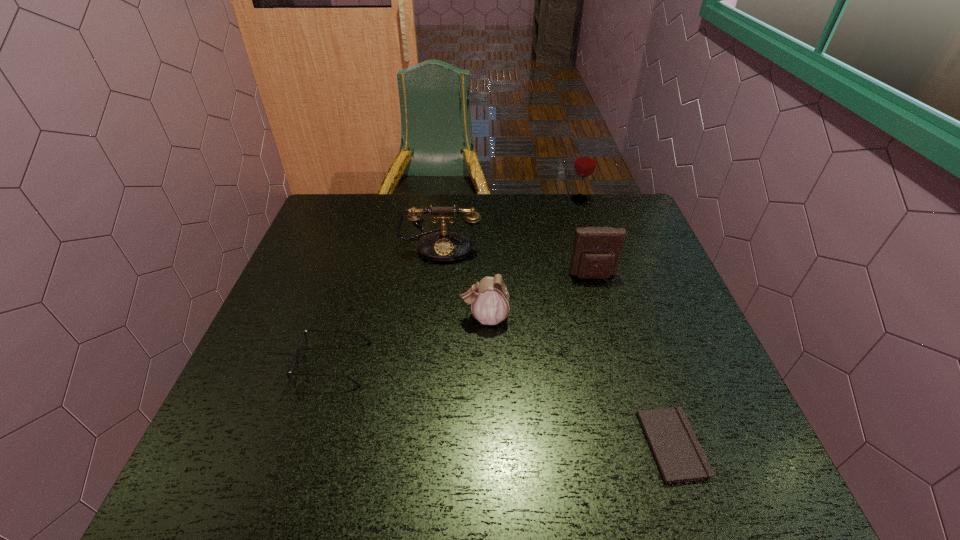
The height and width of the screenshot is (540, 960). What are the coordinates of `telephone at the far edge` in the screenshot? It's located at (444, 246).

At what (x,y) coordinates should I click in order to perform the action: click on object at the near edge. Please return your answer as a coordinate pair (x, y). Image resolution: width=960 pixels, height=540 pixels. Looking at the image, I should click on (680, 458).

Image resolution: width=960 pixels, height=540 pixels. What are the coordinates of `object that is at the left edge` in the screenshot? It's located at (304, 332).

Where is `glass positioned at the right edge`? This screenshot has width=960, height=540. glass positioned at the right edge is located at coordinates (585, 162).

The width and height of the screenshot is (960, 540). In order to click on pouch that is at the right edge in this screenshot , I will do click(597, 250).

Where is `checkbook located in the right edge section of the desktop`? This screenshot has height=540, width=960. checkbook located in the right edge section of the desktop is located at coordinates (680, 458).

This screenshot has width=960, height=540. I want to click on object that is at the far right corner, so click(585, 162).

Where is `object located at the near right corner`? The height and width of the screenshot is (540, 960). object located at the near right corner is located at coordinates (680, 458).

I want to click on vacant area at the far edge of the desktop, so pyautogui.click(x=426, y=207).

At what (x,y) coordinates should I click in order to perform the action: click on vacant point at the left edge. Please return your answer as a coordinate pair (x, y). The height and width of the screenshot is (540, 960). Looking at the image, I should click on (268, 402).